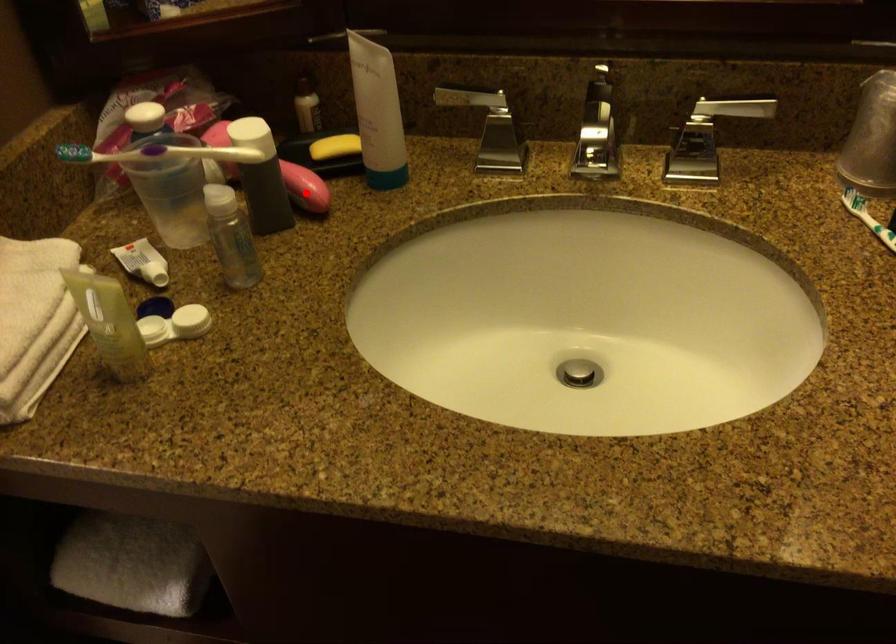
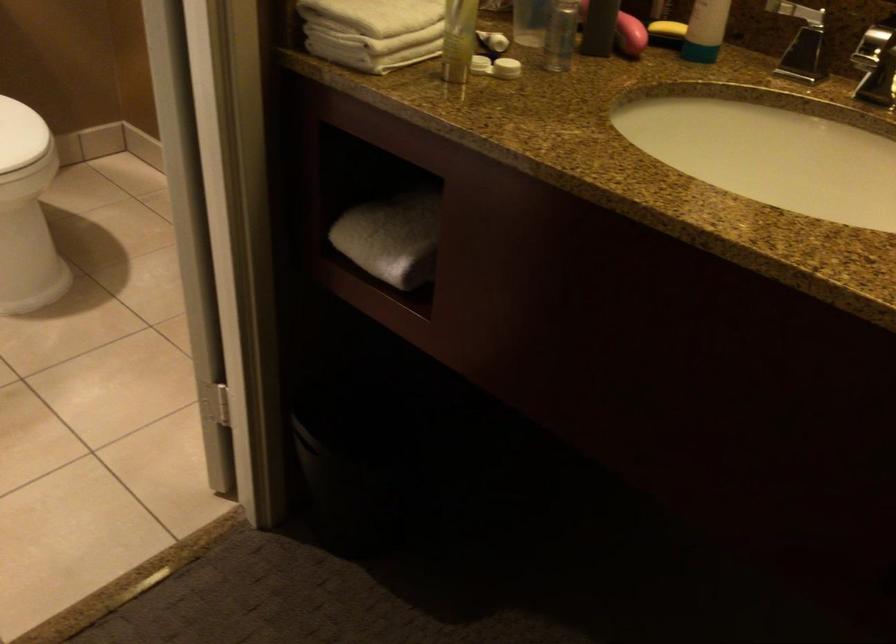
Find the pixel in the second image that matches the highlighted location in the first image.

(630, 35)